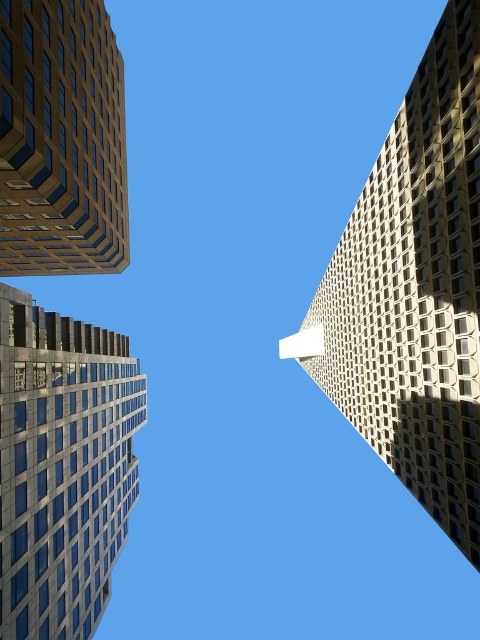
Who is shorter, beige textured building at right or metallic glass skyscraper at center?

With less height is metallic glass skyscraper at center.

Which of these two, beige textured building at right or metallic glass skyscraper at center, stands taller?

beige textured building at right is taller.

Is point (406, 93) in front of point (111, 360)?

Yes, it is.

At what (x,y) coordinates should I click in order to perform the action: click on beige textured building at right. Please return your answer as a coordinate pair (x, y). Looking at the image, I should click on (415, 291).

Looking at this image, is metallic glass skyscraper at center taller than matte glass building at upper left?

Correct, metallic glass skyscraper at center is much taller as matte glass building at upper left.

Is metallic glass skyscraper at center below matte glass building at upper left?

Indeed, metallic glass skyscraper at center is positioned under matte glass building at upper left.

Is point (59, 417) positioned behind point (28, 36)?

Yes.

Where is `metallic glass skyscraper at center`? This screenshot has height=640, width=480. metallic glass skyscraper at center is located at coordinates (61, 467).

Is beige textured building at right above matte glass building at upper left?

No, beige textured building at right is not above matte glass building at upper left.

Is beige textured building at right shorter than matte glass building at upper left?

In fact, beige textured building at right may be taller than matte glass building at upper left.

Which is in front, point (408, 422) or point (59, 8)?

Point (59, 8) is in front.

Where is `beige textured building at right`? The width and height of the screenshot is (480, 640). beige textured building at right is located at coordinates (415, 291).